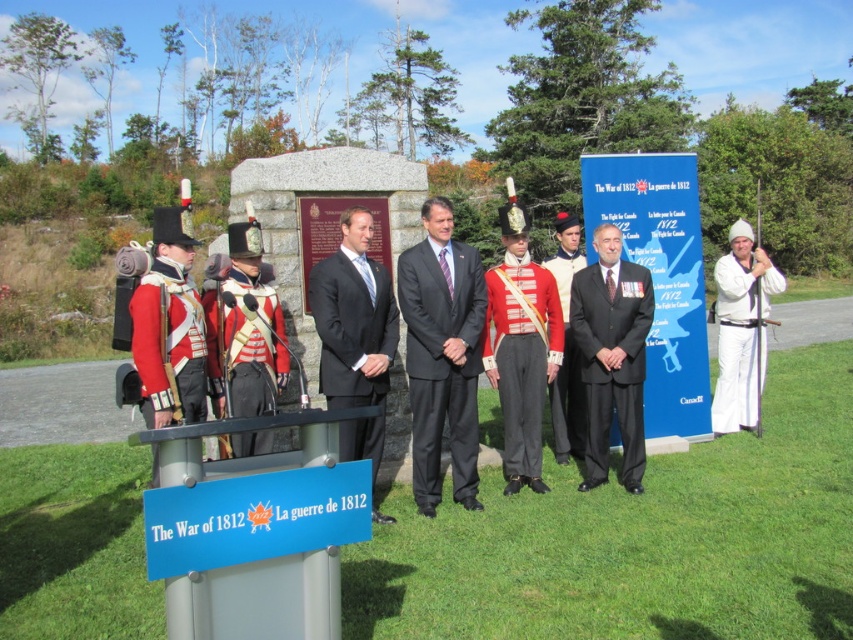
Question: Is black suit at center below red wool uniform at center?

Choices:
 (A) no
 (B) yes

Answer: (A)

Question: Can you confirm if matte red uniform at left is bigger than red and white uniform at center?

Choices:
 (A) no
 (B) yes

Answer: (A)

Question: Considering the real-world distances, which object is closest to the matte black suit at center?

Choices:
 (A) dark gray suit at center
 (B) black suit at center
 (C) red and white uniform at center
 (D) red wool uniform at center

Answer: (B)

Question: Which point is farther to the camera?

Choices:
 (A) red wool uniform at center
 (B) matte red uniform at left
 (C) white matte suit at center

Answer: (C)

Question: Which of the following is the farthest from the observer?

Choices:
 (A) (608, 307)
 (B) (405, 282)

Answer: (A)

Question: Is matte black suit at center in front of red wool uniform at center?

Choices:
 (A) no
 (B) yes

Answer: (B)